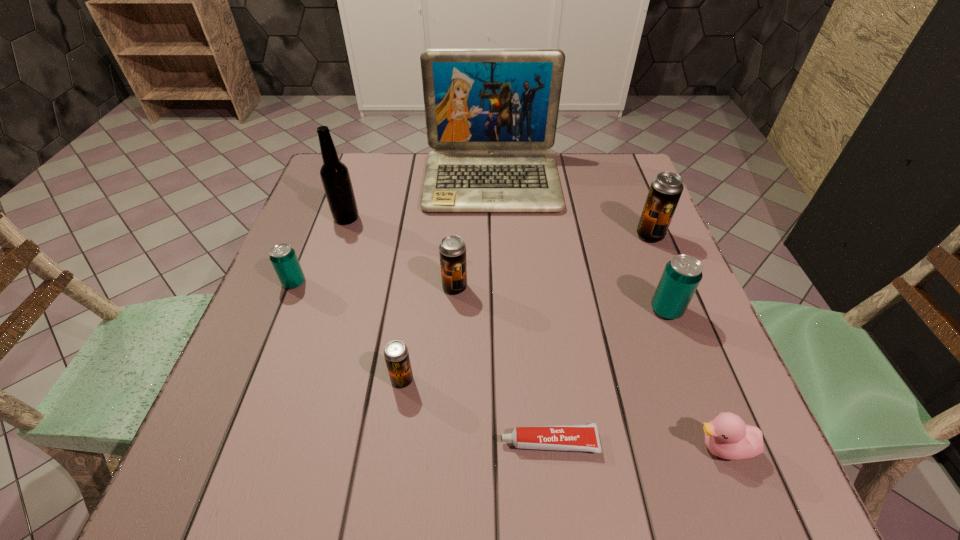
I want to click on duckling positioned at the near edge, so click(x=727, y=436).

Find the location of `toothpaste located in the near edge section of the desktop`. toothpaste located in the near edge section of the desktop is located at coordinates (582, 437).

I want to click on beer bottle present at the left edge, so click(x=335, y=176).

This screenshot has height=540, width=960. I want to click on beer can that is at the left edge, so click(282, 256).

Image resolution: width=960 pixels, height=540 pixels. I want to click on duckling that is at the right edge, so click(727, 436).

Find the location of a particular element. object positioned at the near right corner is located at coordinates (727, 436).

This screenshot has width=960, height=540. In the image, there is a desktop. Identify the location of vacant space at the far edge. (569, 192).

I want to click on free point at the left edge, so click(x=274, y=424).

This screenshot has height=540, width=960. Identify the location of free space at the right edge. (636, 291).

This screenshot has height=540, width=960. Identify the location of free space at the far left corner of the desktop. (376, 166).